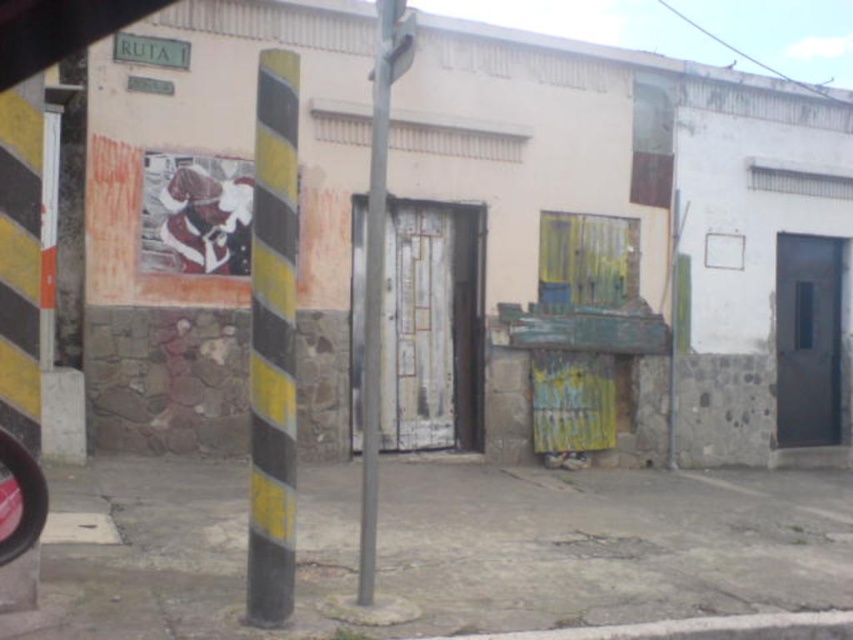
Based on the photo, you are standing at the entrance of the building in the image. Looking towards the center of the scene, you notice a specific point marked at coordinates [607,545]. What type of surface is located at that point?

The point at coordinates [607,545] is covered with concrete pavement at center.

You are standing in front of the building depicted in the scene. There are two points marked on the building wall. The first point is at coordinates point (279, 472) and the second point is at point (402, 20). Which of these two points is closer to your current position?

Point (279, 472) is closer to the viewer than point (402, 20).

You are a delivery person trying to park your 1.5 meter wide cart between the concrete pavement at center and the metallic gray pole at center. Can you fit your cart in this space?

The concrete pavement at center is bigger than the metallic gray pole at center, but the description does not specify the width of the space between them. Therefore, it is unclear if the 1.5 meter wide cart can fit.